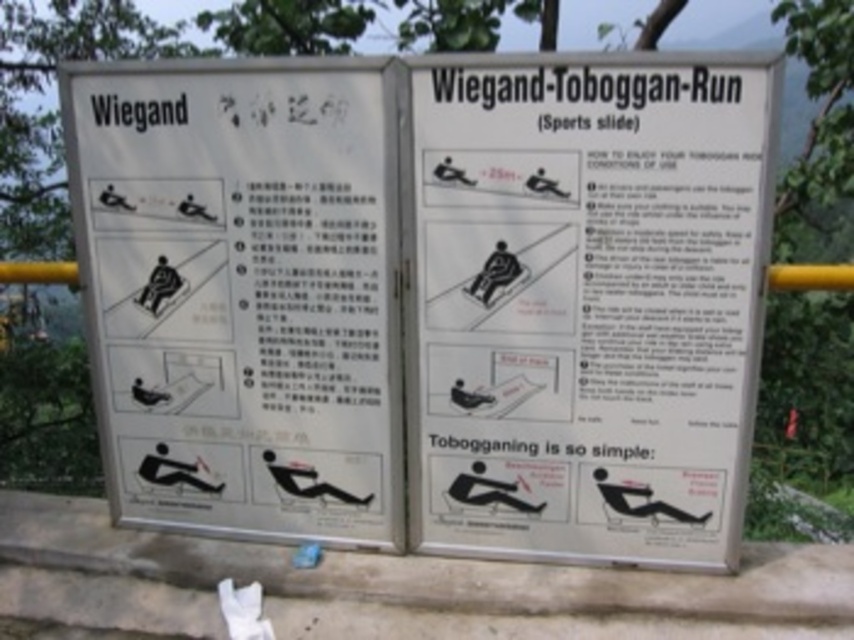
Between point (623, 314) and point (250, 272), which one is positioned behind?

The point (250, 272) is more distant.

Can you confirm if white paper sign at center is positioned below white paper signage at upper left?

Correct, white paper sign at center is located below white paper signage at upper left.

Describe the element at coordinates (585, 301) in the screenshot. This screenshot has width=854, height=640. I see `white paper sign at center` at that location.

Where is `white paper sign at center`? This screenshot has height=640, width=854. white paper sign at center is located at coordinates (585, 301).